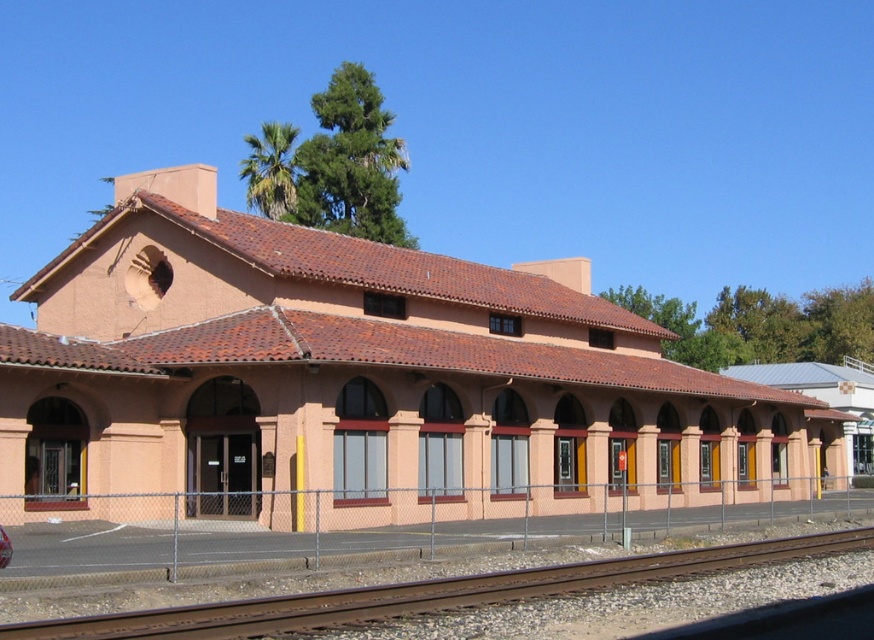
Question: Is matte pink building at center below rusty metal train track at lower left?

Choices:
 (A) yes
 (B) no

Answer: (B)

Question: Can you confirm if matte pink building at center is positioned to the right of rusty metal train track at lower left?

Choices:
 (A) yes
 (B) no

Answer: (A)

Question: Can you confirm if matte pink building at center is positioned below rusty metal train track at lower left?

Choices:
 (A) no
 (B) yes

Answer: (A)

Question: Which point is farther to the camera?

Choices:
 (A) (449, 609)
 (B) (202, 211)

Answer: (B)